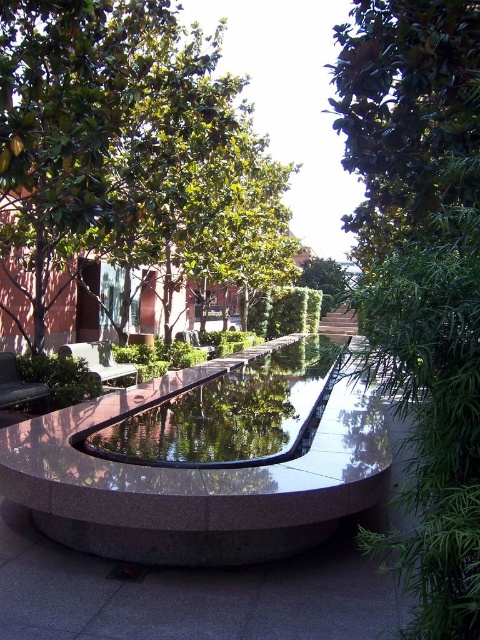
From the picture: Does green leafy tree at upper left appear over glossy concrete pond at center?

Yes, green leafy tree at upper left is above glossy concrete pond at center.

The image size is (480, 640). What do you see at coordinates (128, 150) in the screenshot? I see `green leafy tree at upper left` at bounding box center [128, 150].

Find the location of a particular element. Image resolution: width=480 pixels, height=640 pixels. green leafy tree at upper left is located at coordinates (128, 150).

Which is more to the left, glossy concrete pond at center or green fabric bench at lower left?

green fabric bench at lower left

Does point (283, 394) lie behind point (14, 394)?

Yes, it is.

Image resolution: width=480 pixels, height=640 pixels. What do you see at coordinates (228, 413) in the screenshot?
I see `glossy concrete pond at center` at bounding box center [228, 413].

You are a GUI agent. You are given a task and a screenshot of the screen. Output one action in this format:
    pyautogui.click(x=<x>, y=<y>)
    Task: Click on the glossy concrete pond at center
    The width and height of the screenshot is (480, 640).
    Given the screenshot: What is the action you would take?
    pyautogui.click(x=228, y=413)

Does green leafy tree at center have a larger size compared to glossy concrete pond at center?

Yes, green leafy tree at center is bigger than glossy concrete pond at center.

Based on the photo, who is shorter, green leafy tree at center or glossy concrete pond at center?

Standing shorter between the two is glossy concrete pond at center.

Describe the element at coordinates (422, 269) in the screenshot. I see `green leafy tree at center` at that location.

Locate an element on the screen. green leafy tree at center is located at coordinates (422, 269).